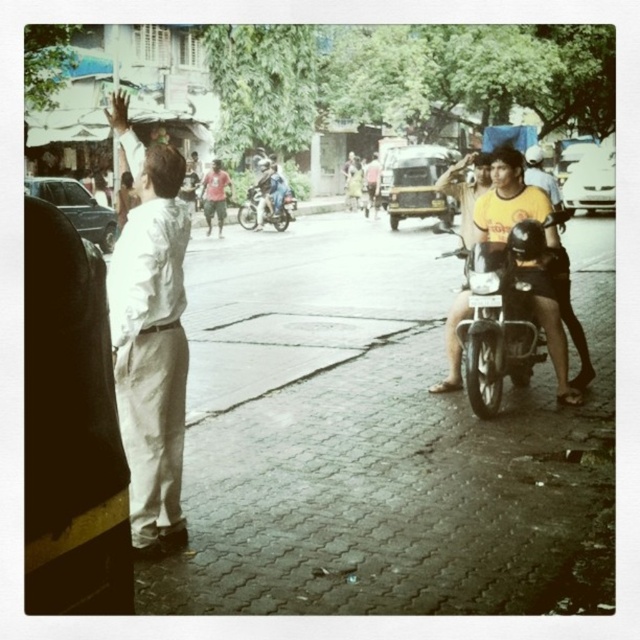
Is point (154, 323) closer to viewer compared to point (512, 380)?

That is True.

Is white shirt at left closer to the viewer compared to black matte motorcycle at center-right?

Yes, it is in front of black matte motorcycle at center-right.

Locate an element on the screen. This screenshot has height=640, width=640. white shirt at left is located at coordinates (150, 333).

Who is more forward, (496, 304) or (256, 212)?

Positioned in front is point (496, 304).

Is black matte motorcycle at center-right closer to the viewer compared to metallic silver motorcycle at center?

Yes, black matte motorcycle at center-right is closer to the viewer.

Is point (484, 410) less distant than point (252, 211)?

Yes, point (484, 410) is closer to viewer.

At what (x,y) coordinates should I click in order to perform the action: click on black matte motorcycle at center-right. Please return your answer as a coordinate pair (x, y). Looking at the image, I should click on (502, 314).

Is white shirt at left above metallic silver motorcycle at center?

Incorrect, white shirt at left is not positioned above metallic silver motorcycle at center.

The image size is (640, 640). What do you see at coordinates (150, 333) in the screenshot? I see `white shirt at left` at bounding box center [150, 333].

Between point (173, 369) and point (262, 218), which one is positioned behind?

Positioned behind is point (262, 218).

Locate an element on the screen. The width and height of the screenshot is (640, 640). white shirt at left is located at coordinates (150, 333).